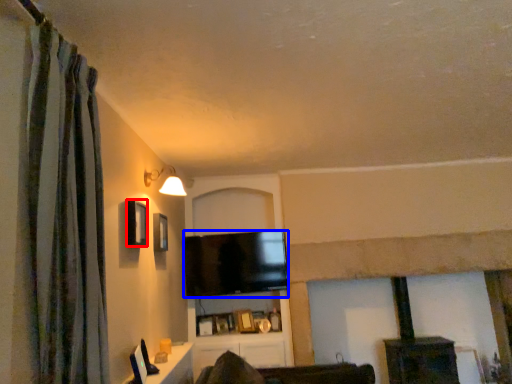
Question: Which object appears farthest to the camera in this image, window (highlighted by a red box) or television (highlighted by a blue box)?

Choices:
 (A) window
 (B) television

Answer: (B)